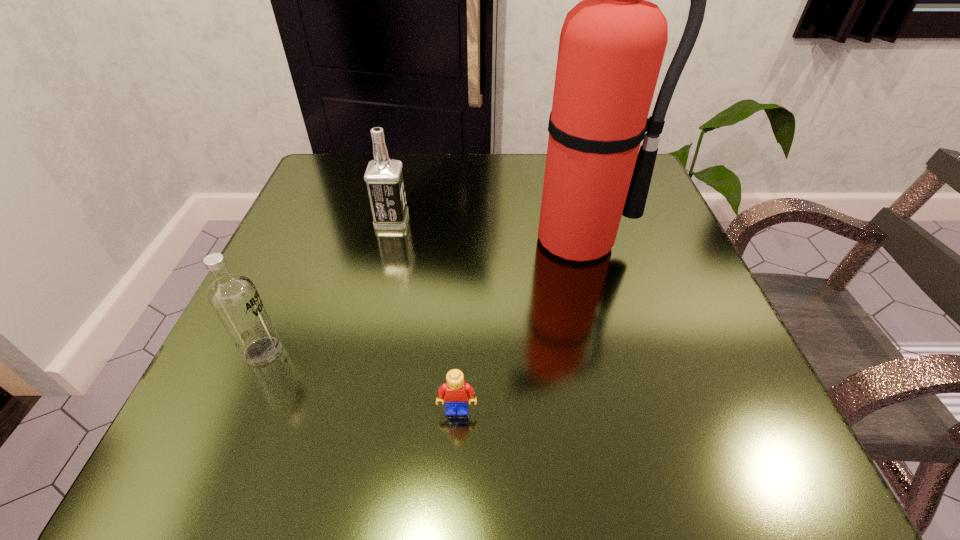
I want to click on vacant space at the far left corner, so 327,171.

At what (x,y) coordinates should I click in order to perform the action: click on free space at the far right corner of the desktop. Please return your answer as a coordinate pair (x, y). Looking at the image, I should click on (646, 210).

Locate an element on the screen. empty space that is in between the shortest object and the fire extinguisher is located at coordinates point(517,325).

Where is `free spot between the fire extinguisher and the shortest object`? free spot between the fire extinguisher and the shortest object is located at coordinates (517, 325).

Where is `vacant point located between the left vodka and the farther vodka`? Image resolution: width=960 pixels, height=540 pixels. vacant point located between the left vodka and the farther vodka is located at coordinates (327, 286).

Where is `free point between the third object from left to right and the farther vodka`? free point between the third object from left to right and the farther vodka is located at coordinates (424, 315).

Identify the location of vacant area that lies between the nearest object and the rightmost object. The height and width of the screenshot is (540, 960). (517, 325).

At what (x,y) coordinates should I click in order to perform the action: click on vacant area that lies between the second object from left to right and the left vodka. Please return your answer as a coordinate pair (x, y). Looking at the image, I should click on (327, 286).

The image size is (960, 540). What are the coordinates of `free space between the right vodka and the rightmost object` in the screenshot? It's located at (485, 231).

Find the location of a particular element. free space between the farther vodka and the rightmost object is located at coordinates (485, 231).